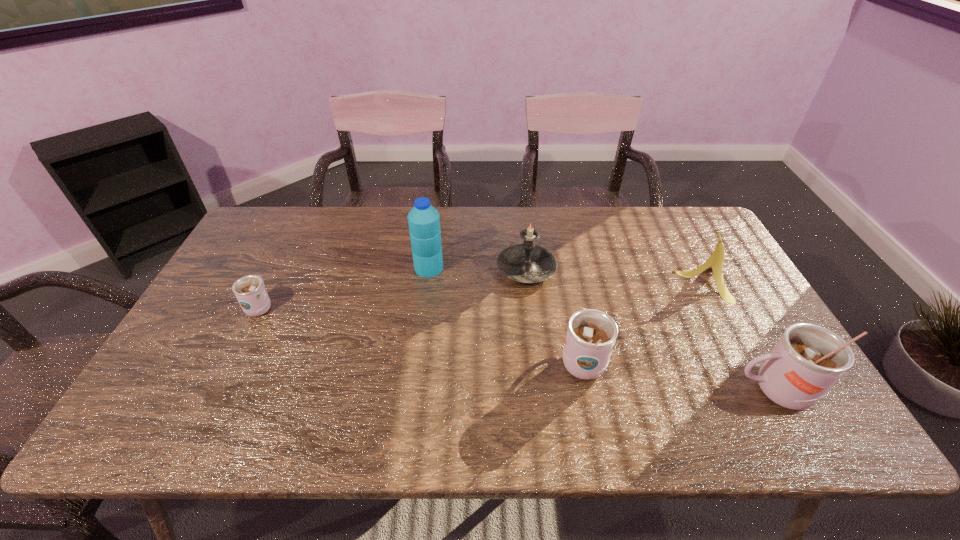
Find the location of a particular element. free space located 0.080m on the side with the handle of the second cup from left to right is located at coordinates [x=572, y=310].

The image size is (960, 540). I want to click on vacant space located 0.320m on the side with the handle of the second cup from left to right, so click(x=561, y=254).

Locate an element on the screen. Image resolution: width=960 pixels, height=540 pixels. vacant space located on the side with the handle of the second cup from left to right is located at coordinates [566, 282].

This screenshot has width=960, height=540. Find the location of `vacant space located 0.330m on the side with the handle of the rightmost cup`. vacant space located 0.330m on the side with the handle of the rightmost cup is located at coordinates (589, 390).

Identify the location of vacant area situated 0.330m on the side with the handle of the rightmost cup. (589, 390).

The height and width of the screenshot is (540, 960). In order to click on free region located 0.210m on the side with the handle of the rightmost cup in this screenshot , I will do `click(641, 390)`.

At what (x,y) coordinates should I click in order to perform the action: click on vacant region located on the left of the banana. Please return your answer as a coordinate pair (x, y). Looking at the image, I should click on (562, 281).

Locate an element on the screen. Image resolution: width=960 pixels, height=540 pixels. vacant point located 0.220m on the front of the candle is located at coordinates (536, 350).

The image size is (960, 540). Find the location of `vacant area located 0.250m on the right of the second object from left to right`. vacant area located 0.250m on the right of the second object from left to right is located at coordinates (525, 268).

The width and height of the screenshot is (960, 540). Identify the location of object that is positioned at the far edge. (527, 263).